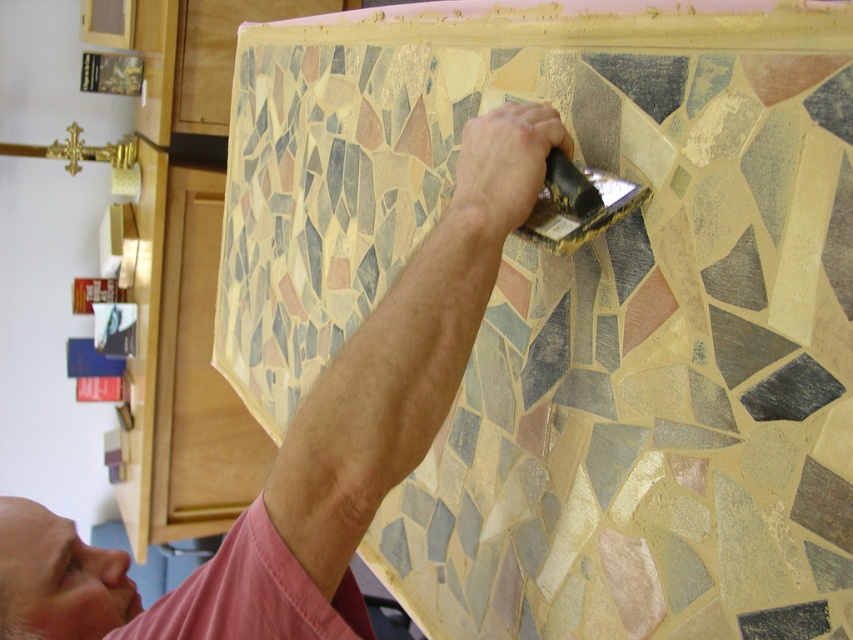
You are looking at the image of a person working on a mosaic. You notice two shirts labeled pink fabric shirt at upper center and pink cotton shirt at upper center. Which shirt is positioned to the right?

The pink fabric shirt at upper center is positioned to the right of the pink cotton shirt at upper center.

You are an art restorer working on a mosaic panel. You need to place a new tile between the multicolored mosaic tile at upper center and the gold metallic putty knife at upper center. The new tile is 10 inches long. Is there enough space to fit it without overlapping?

The distance between the multicolored mosaic tile at upper center and the gold metallic putty knife at upper center is 21.43 inches. Since the new tile is only 10 inches long, there is sufficient space to place it between them without overlapping.

Based on the coordinates provided, where is the multicolored mosaic tile at upper center located in the image?

The multicolored mosaic tile at upper center is located at the coordinates point [576,317].